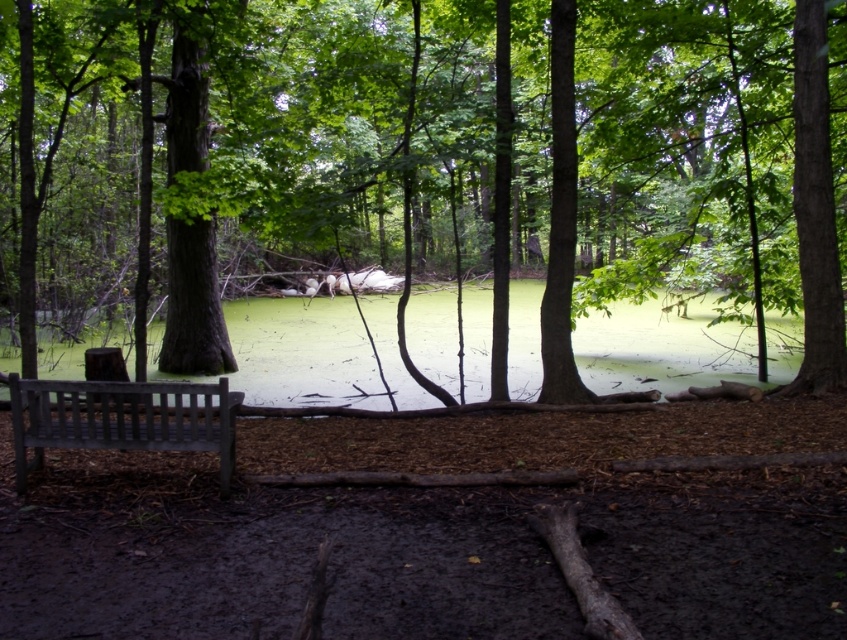
Question: Which of the following is the farthest from the observer?

Choices:
 (A) (397, 378)
 (B) (137, 413)
 (C) (316, 150)

Answer: (A)

Question: From the image, what is the correct spatial relationship of green algae water at center in relation to wooden bench at left?

Choices:
 (A) below
 (B) above

Answer: (B)

Question: Does green algae water at center lie behind wooden bench at left?

Choices:
 (A) yes
 (B) no

Answer: (A)

Question: Does green algae water at center appear over wooden bench at left?

Choices:
 (A) yes
 (B) no

Answer: (A)

Question: Which point is farther to the camera?

Choices:
 (A) brown wood tree at center
 (B) wooden bench at left
 (C) green algae water at center

Answer: (C)

Question: Among these objects, which one is nearest to the camera?

Choices:
 (A) green algae water at center
 (B) wooden bench at left
 (C) brown wood tree at center

Answer: (B)